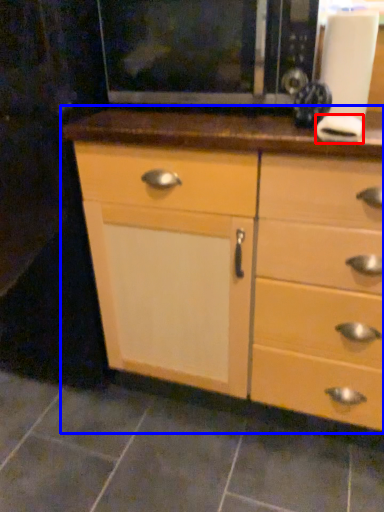
Question: Which point is further to the camera, knob (highlighted by a red box) or chest of drawers (highlighted by a blue box)?

Choices:
 (A) knob
 (B) chest of drawers

Answer: (A)